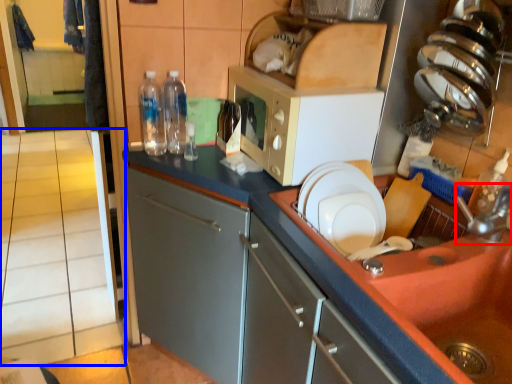
Question: Which object appears closest to the camera in this image, faucet (highlighted by a red box) or tile (highlighted by a blue box)?

Choices:
 (A) faucet
 (B) tile

Answer: (A)